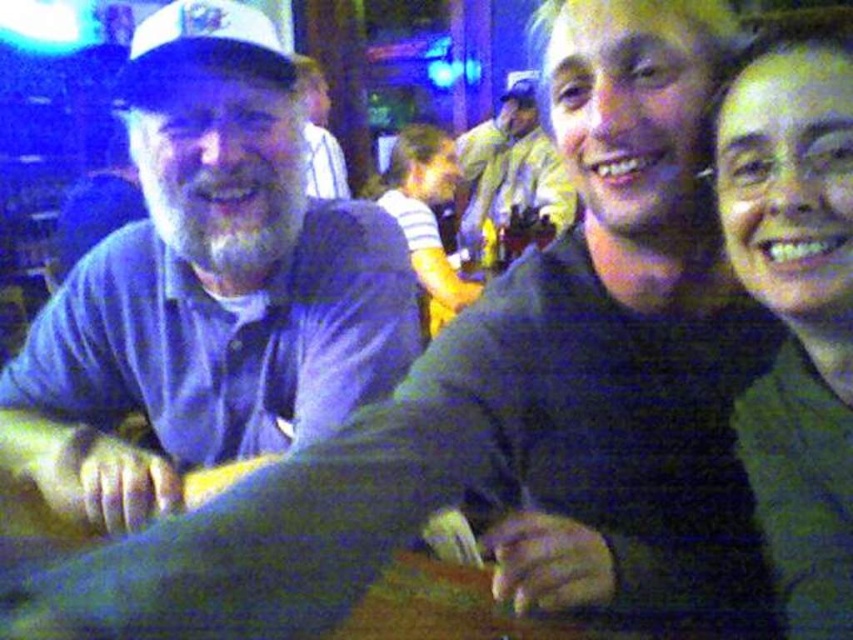
Is point (532, 72) positioned before point (312, 116)?

Yes, it is.

Is point (463, 145) positioned after point (328, 115)?

No.

Image resolution: width=853 pixels, height=640 pixels. What are the coordinates of `yellowish-green jacket at center` in the screenshot? It's located at (512, 166).

Does blue cotton shirt at left appear under matte white cap at upper left?

Correct, blue cotton shirt at left is located below matte white cap at upper left.

Can you confirm if blue cotton shirt at left is shorter than matte white cap at upper left?

Correct, blue cotton shirt at left is not as tall as matte white cap at upper left.

Does point (219, 275) come behind point (341, 189)?

No, it is not.

Image resolution: width=853 pixels, height=640 pixels. I want to click on blue cotton shirt at left, so click(x=207, y=288).

Can you confirm if green fuzzy sweater at upper right is positioned to the left of matte white cap at upper left?

Incorrect, green fuzzy sweater at upper right is not on the left side of matte white cap at upper left.

Is point (741, 77) closer to viewer compared to point (322, 90)?

Yes, point (741, 77) is closer to viewer.

Between point (743, 412) and point (321, 138), which one is positioned in front?

Point (743, 412) is more forward.

Where is `green fuzzy sweater at upper right`? The width and height of the screenshot is (853, 640). green fuzzy sweater at upper right is located at coordinates (796, 307).